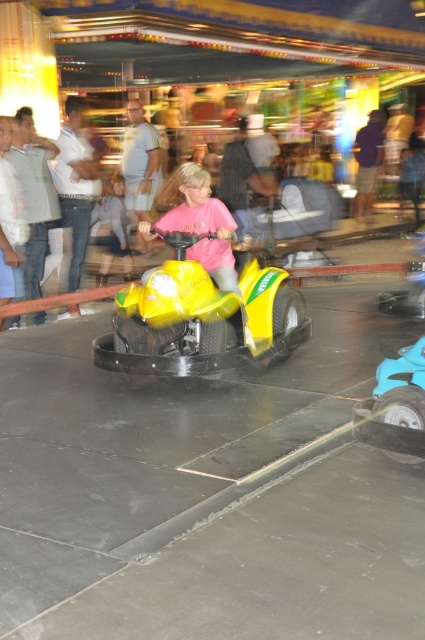
Is yellow matte go-kart at center above light blue denim jeans at center?

Incorrect, yellow matte go-kart at center is not positioned above light blue denim jeans at center.

Does point (176, 358) come behind point (141, 134)?

No, it is not.

Image resolution: width=425 pixels, height=640 pixels. In order to click on yellow matte go-kart at center in this screenshot , I will do `click(200, 317)`.

Who is more forward, (195, 330) or (411, 384)?

Positioned in front is point (411, 384).

Which of these two, yellow matte go-kart at center or blue rubber toy car at lower right, stands shorter?

With less height is blue rubber toy car at lower right.

Find the location of a particular element. yellow matte go-kart at center is located at coordinates (200, 317).

Does blue rubber toy car at lower right appear on the left side of light blue denim jeans at center?

In fact, blue rubber toy car at lower right is to the right of light blue denim jeans at center.

Is point (357, 435) farther from viewer compared to point (158, 148)?

No, it is not.

In order to click on blue rubber toy car at lower right in this screenshot , I will do `click(396, 406)`.

The width and height of the screenshot is (425, 640). Identify the location of blue rubber toy car at lower right. (396, 406).